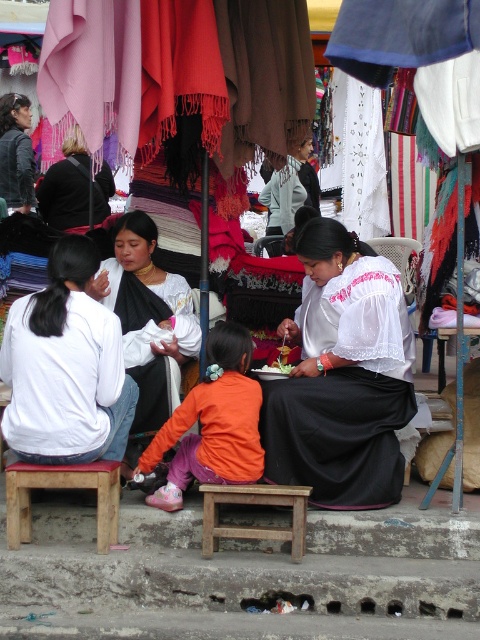
Question: Among these points, which one is nearest to the camera?

Choices:
 (A) (84, 444)
 (B) (130, 228)
 (C) (10, 522)
 (D) (247, 380)

Answer: (A)

Question: Which point is closer to the camera?

Choices:
 (A) (133, 451)
 (B) (88, 248)
 (C) (204, 477)
 (D) (248, 536)

Answer: (D)

Question: Which of the following is the closest to the observer?

Choices:
 (A) (355, 358)
 (B) (186, 419)

Answer: (B)

Question: Does black woven fabric at center appear under wooden stool at lower center?

Choices:
 (A) yes
 (B) no

Answer: (B)

Question: Can you confirm if white lace blouse at center is bigger than white matte shirt at left?

Choices:
 (A) yes
 (B) no

Answer: (A)

Question: Does white lace blouse at center appear under wooden stool at lower center?

Choices:
 (A) yes
 (B) no

Answer: (B)